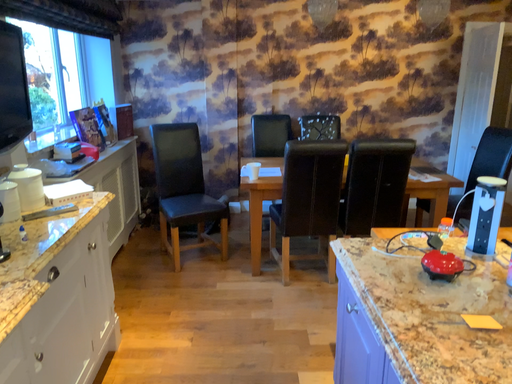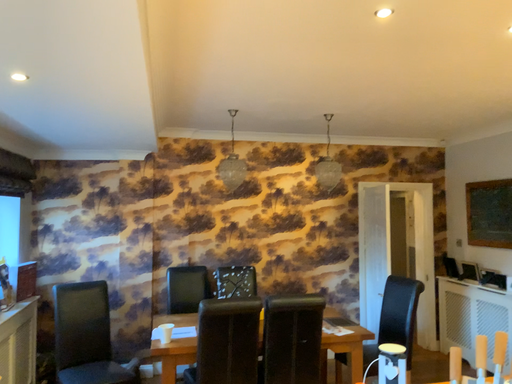
Question: How did the camera likely rotate when shooting the video?

Choices:
 (A) rotated downward
 (B) rotated upward

Answer: (B)